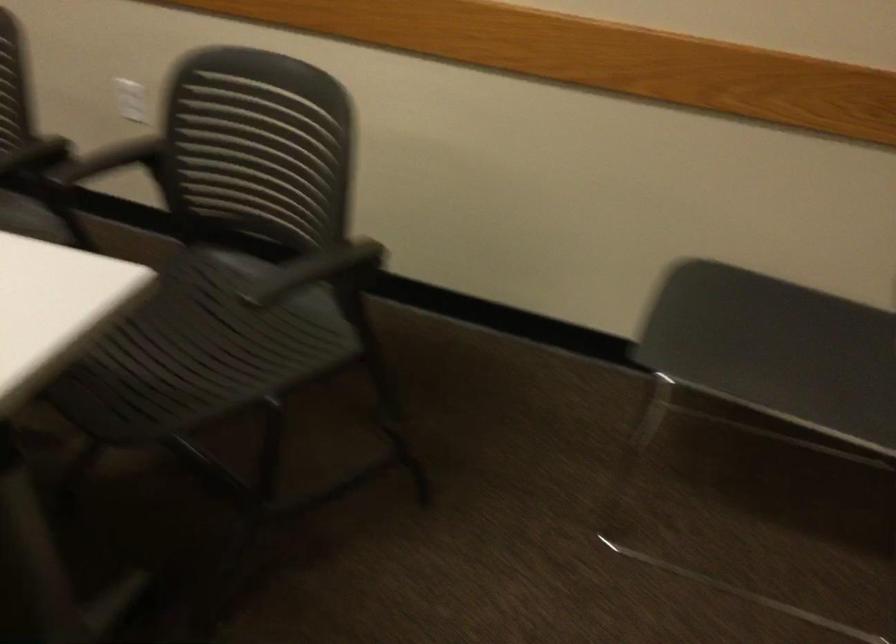
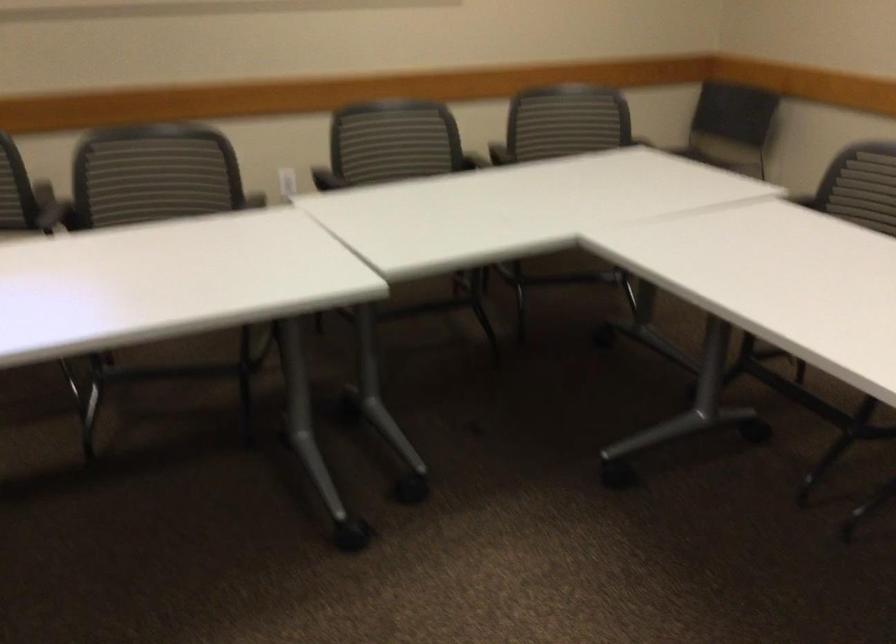
In the second image, find the point that corresponds to point 613,143 in the first image.

(569, 114)